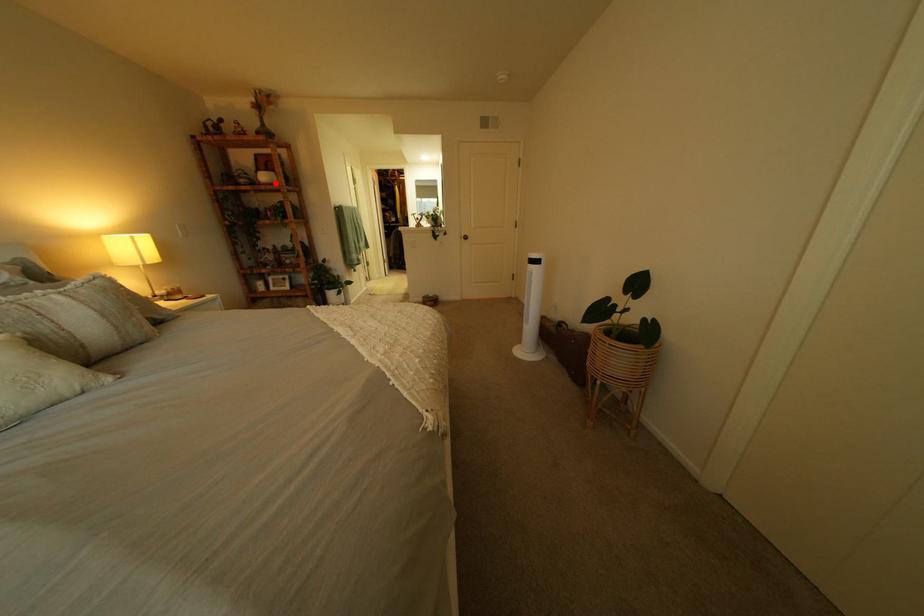
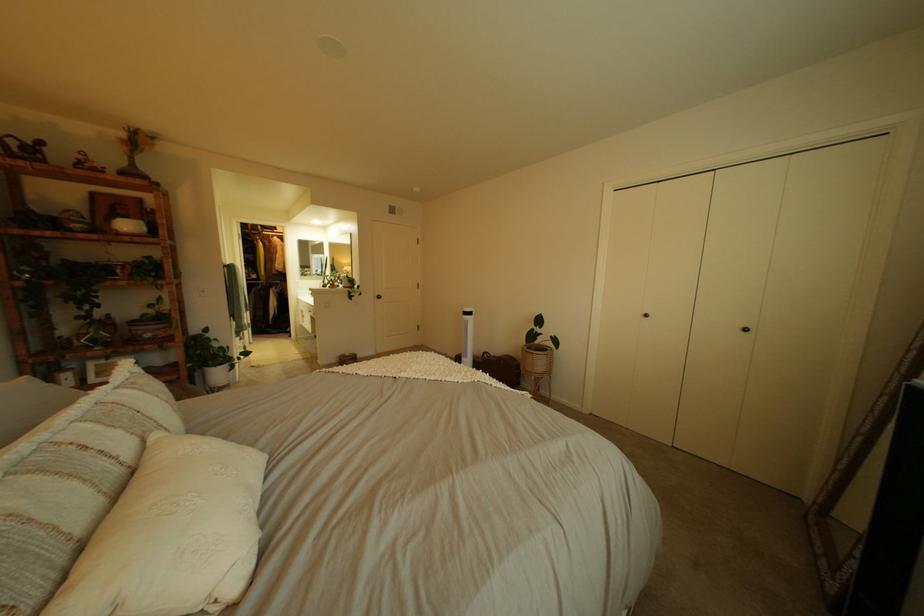
Question: I am providing you with two images of the same scene from different viewpoints. Given a red point in image1, look at the same physical point in image2. Is it:

Choices:
 (A) Closer to the viewpoint
 (B) Farther from the viewpoint

Answer: (B)